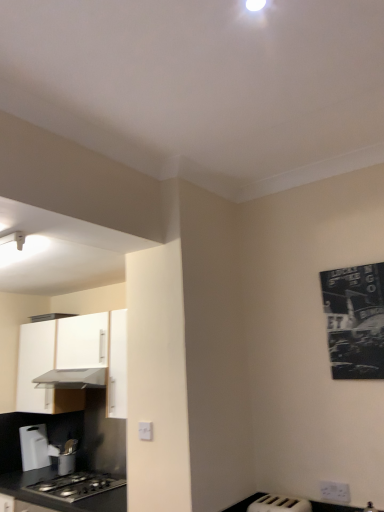
Question: Can you confirm if white matte cabinet at left is wider than metallic silver utensil holder at lower left, the first appliance in the bottom-to-top sequence?

Choices:
 (A) yes
 (B) no

Answer: (A)

Question: From the image's perspective, is white matte cabinet at left above metallic silver utensil holder at lower left, which ranks as the 1th appliance in left-to-right order?

Choices:
 (A) yes
 (B) no

Answer: (A)

Question: Would you say white matte cabinet at left is outside metallic silver utensil holder at lower left, which is the 2th appliance in right-to-left order?

Choices:
 (A) no
 (B) yes

Answer: (B)

Question: Can you confirm if white matte cabinet at left is positioned to the left of metallic silver utensil holder at lower left, which ranks as the first appliance in back-to-front order?

Choices:
 (A) no
 (B) yes

Answer: (A)

Question: Can you confirm if white matte cabinet at left is taller than metallic silver utensil holder at lower left, which ranks as the first appliance in back-to-front order?

Choices:
 (A) no
 (B) yes

Answer: (B)

Question: Can you confirm if white matte cabinet at left is smaller than metallic silver utensil holder at lower left, which is the 2th appliance in right-to-left order?

Choices:
 (A) no
 (B) yes

Answer: (A)

Question: Does white plastic electric outlet at lower right, which is the 1th electric outlet in bottom-to-top order, lie behind white plastic electric outlet at lower center, arranged as the 1th electric outlet when viewed from the top?

Choices:
 (A) yes
 (B) no

Answer: (B)

Question: Is white plastic electric outlet at lower right, the first electric outlet in the right-to-left sequence, smaller than white plastic electric outlet at lower center, positioned as the 1th electric outlet in left-to-right order?

Choices:
 (A) yes
 (B) no

Answer: (B)

Question: Is white plastic electric outlet at lower center, positioned as the 1th electric outlet in left-to-right order, at the back of white plastic electric outlet at lower right, the second electric outlet in the top-to-bottom sequence?

Choices:
 (A) yes
 (B) no

Answer: (B)

Question: Can you confirm if white plastic electric outlet at lower right, which is the 1th electric outlet in bottom-to-top order, is bigger than white plastic electric outlet at lower center, which ranks as the 2th electric outlet in right-to-left order?

Choices:
 (A) yes
 (B) no

Answer: (A)

Question: Is the position of white plastic electric outlet at lower right, the second electric outlet in the top-to-bottom sequence, less distant than that of white plastic electric outlet at lower center, which ranks as the 2th electric outlet in right-to-left order?

Choices:
 (A) no
 (B) yes

Answer: (B)

Question: Can you confirm if white plastic electric outlet at lower right, which is the 1th electric outlet in bottom-to-top order, is taller than white plastic electric outlet at lower center, positioned as the 1th electric outlet in left-to-right order?

Choices:
 (A) no
 (B) yes

Answer: (B)

Question: Does black matte countertop at lower left come behind metallic silver utensil holder at lower left, which ranks as the 1th appliance in left-to-right order?

Choices:
 (A) no
 (B) yes

Answer: (A)